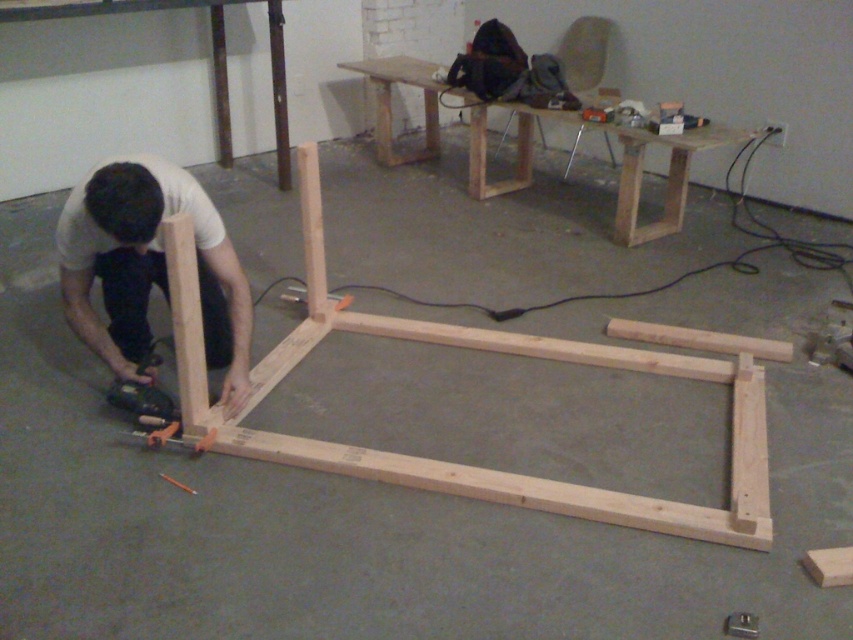
You are a contractor working on a project and need to know the relative sizes of the tools and materials. Based on the scene, which object is larger between the natural wood frame at center and the metallic gray drill at lower left?

The natural wood frame at center is bigger than the metallic gray drill at lower left.

Looking at this image, you are standing at the entrance of the workspace and want to reach the natural wood frame at center without stepping on the matte wood man at lower left. Which direction should you move towards?

The natural wood frame at center is to the right of the matte wood man at lower left, so you should move towards the right to avoid stepping on the matte wood man at lower left and reach the natural wood frame at center.